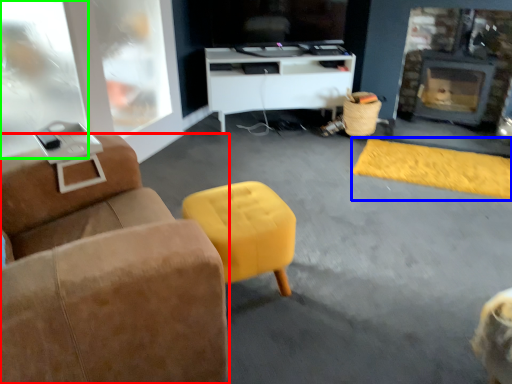
Question: Which object is the farthest from furniture (highlighted by a red box)? Choose among these: flat (highlighted by a blue box) or glass door (highlighted by a green box).

Choices:
 (A) flat
 (B) glass door

Answer: (A)